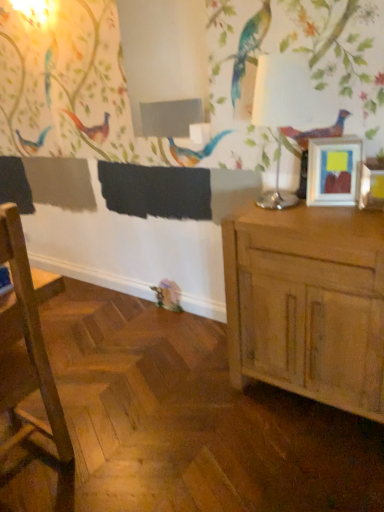
Question: Considering the relative sizes of light brown wood cabinet at right and wooden chair at left in the image provided, is light brown wood cabinet at right taller than wooden chair at left?

Choices:
 (A) no
 (B) yes

Answer: (A)

Question: Is the depth of light brown wood cabinet at right greater than that of wooden chair at left?

Choices:
 (A) yes
 (B) no

Answer: (A)

Question: Is wooden chair at left at the back of light brown wood cabinet at right?

Choices:
 (A) yes
 (B) no

Answer: (B)

Question: Can you confirm if light brown wood cabinet at right is bigger than wooden chair at left?

Choices:
 (A) no
 (B) yes

Answer: (B)

Question: Considering the relative sizes of light brown wood cabinet at right and wooden chair at left in the image provided, is light brown wood cabinet at right shorter than wooden chair at left?

Choices:
 (A) yes
 (B) no

Answer: (A)

Question: Considering the positions of white glossy table lamp at upper right and light brown wood cabinet at right in the image, is white glossy table lamp at upper right bigger or smaller than light brown wood cabinet at right?

Choices:
 (A) small
 (B) big

Answer: (A)

Question: From a real-world perspective, is white glossy table lamp at upper right above or below light brown wood cabinet at right?

Choices:
 (A) above
 (B) below

Answer: (A)

Question: From the image's perspective, is white glossy table lamp at upper right located above or below light brown wood cabinet at right?

Choices:
 (A) above
 (B) below

Answer: (A)

Question: Considering their positions, is white glossy table lamp at upper right located in front of or behind light brown wood cabinet at right?

Choices:
 (A) behind
 (B) front

Answer: (A)

Question: From the image's perspective, is wooden chair at left positioned above or below white glossy table lamp at upper right?

Choices:
 (A) above
 (B) below

Answer: (B)

Question: Considering the positions of point (23, 350) and point (273, 207), is point (23, 350) closer or farther from the camera than point (273, 207)?

Choices:
 (A) farther
 (B) closer

Answer: (B)

Question: In terms of width, does wooden chair at left look wider or thinner when compared to white glossy table lamp at upper right?

Choices:
 (A) wide
 (B) thin

Answer: (A)

Question: From a real-world perspective, is wooden chair at left positioned above or below white glossy table lamp at upper right?

Choices:
 (A) above
 (B) below

Answer: (B)

Question: From the image's perspective, is wooden chair at left above or below light brown wood cabinet at right?

Choices:
 (A) above
 (B) below

Answer: (B)

Question: Looking at their shapes, would you say wooden chair at left is wider or thinner than light brown wood cabinet at right?

Choices:
 (A) thin
 (B) wide

Answer: (B)